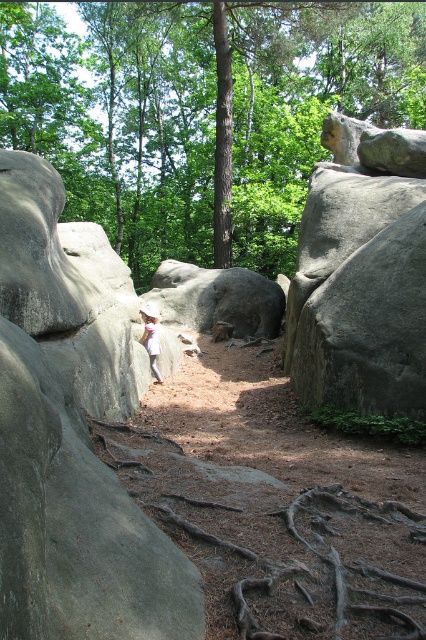
Question: Which of the following is the closest to the observer?

Choices:
 (A) coord(152,348)
 (B) coord(77,525)
 (C) coord(301,228)

Answer: (B)

Question: Which point is farther to the camera?

Choices:
 (A) (x=417, y=513)
 (B) (x=43, y=557)
 (C) (x=334, y=131)

Answer: (C)

Question: Can you confirm if brown/rooted tree roots at center is positioned to the left of white cotton shirt at center?

Choices:
 (A) yes
 (B) no

Answer: (B)

Question: Considering the relative positions of brown/rooted tree roots at center and white cotton shirt at center in the image provided, where is brown/rooted tree roots at center located with respect to white cotton shirt at center?

Choices:
 (A) below
 (B) above

Answer: (A)

Question: Is gray rough rock at left in front of brown/rooted tree roots at center?

Choices:
 (A) no
 (B) yes

Answer: (A)

Question: Which point is farther to the camera?

Choices:
 (A) (149, 310)
 (B) (138, 541)

Answer: (A)